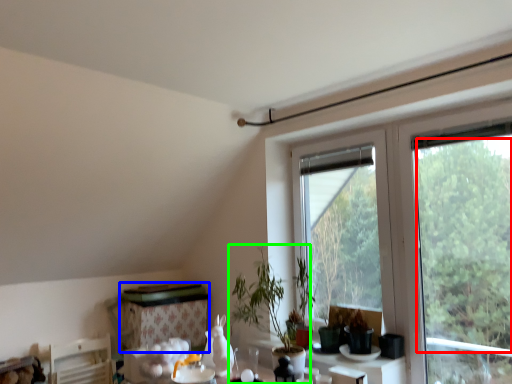
Question: Which object is the farthest from tree (highlighted by a red box)? Choose among these: table (highlighted by a blue box) or houseplant (highlighted by a green box).

Choices:
 (A) table
 (B) houseplant

Answer: (A)